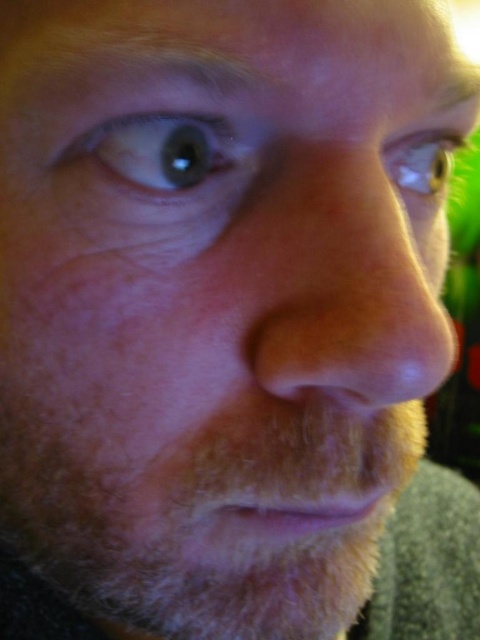
Is blue glossy eye at upper left taller than green glossy eye at upper right?

No, blue glossy eye at upper left is not taller than green glossy eye at upper right.

Who is positioned more to the left, blue glossy eye at upper left or green glossy eye at upper right?

blue glossy eye at upper left

Between point (181, 148) and point (439, 160), which one is positioned in front?

Point (181, 148) is more forward.

Find the location of a particular element. blue glossy eye at upper left is located at coordinates (171, 150).